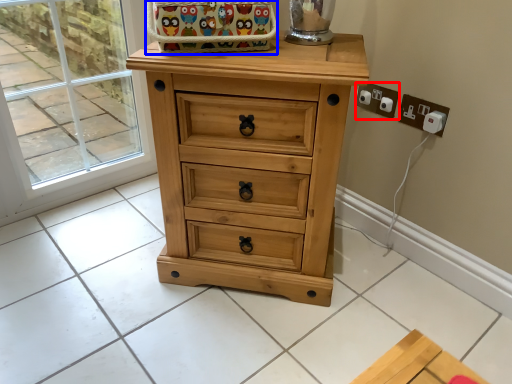
Question: Among these objects, which one is nearest to the camera, electric outlet (highlighted by a red box) or basket (highlighted by a blue box)?

Choices:
 (A) electric outlet
 (B) basket

Answer: (B)